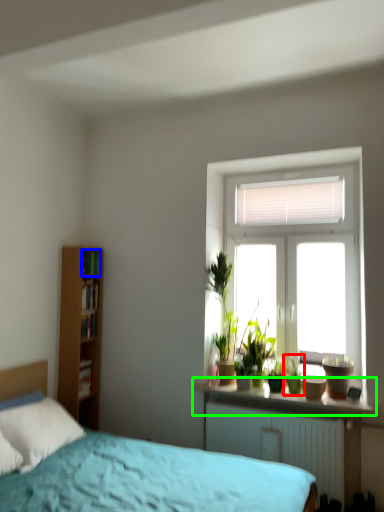
Question: Considering the real-world distances, which object is farthest from houseplant (highlighted by a red box)? book (highlighted by a blue box) or window sill (highlighted by a green box)?

Choices:
 (A) book
 (B) window sill

Answer: (A)